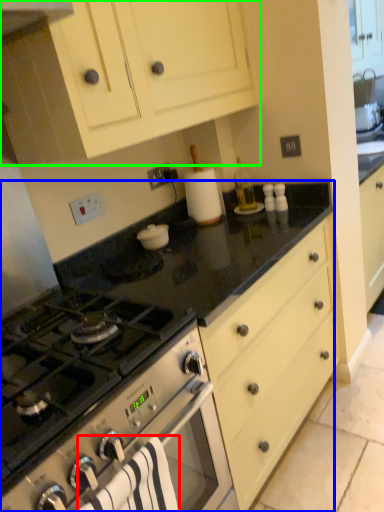
Question: Considering the real-world distances, which object is closest to bath towel (highlighted by a red box)? countertop (highlighted by a blue box) or cabinetry (highlighted by a green box).

Choices:
 (A) countertop
 (B) cabinetry

Answer: (A)